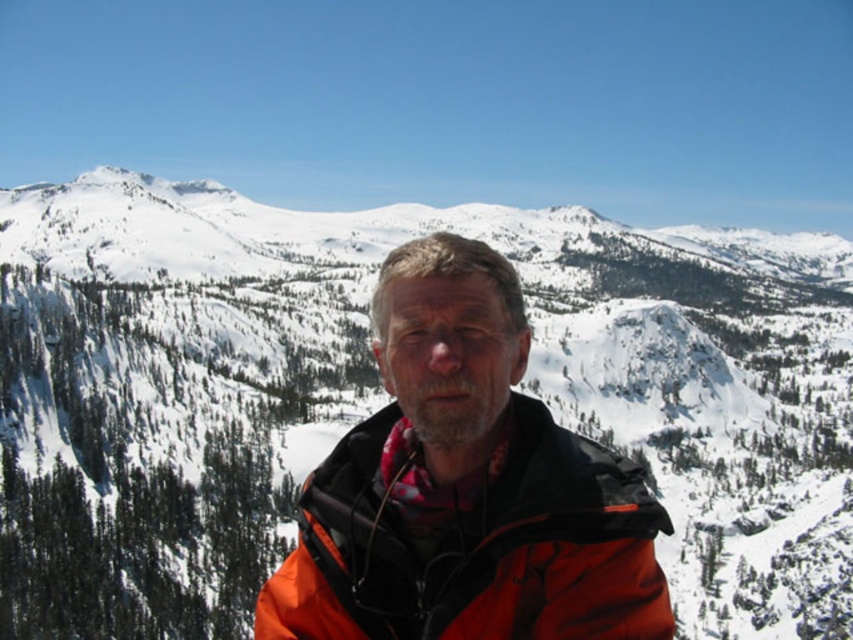
Question: Which object appears farthest from the camera in this image?

Choices:
 (A) orange softshell jacket at center
 (B) snowy mountain at center

Answer: (B)

Question: Can you confirm if snowy mountain at center is positioned to the left of orange softshell jacket at center?

Choices:
 (A) no
 (B) yes

Answer: (A)

Question: Which point is farther to the camera?

Choices:
 (A) (90, 292)
 (B) (628, 492)

Answer: (A)

Question: Does snowy mountain at center have a lesser width compared to orange softshell jacket at center?

Choices:
 (A) no
 (B) yes

Answer: (A)

Question: Can you confirm if snowy mountain at center is positioned below orange softshell jacket at center?

Choices:
 (A) no
 (B) yes

Answer: (A)

Question: Among these points, which one is nearest to the camera?

Choices:
 (A) (793, 332)
 (B) (403, 532)

Answer: (B)